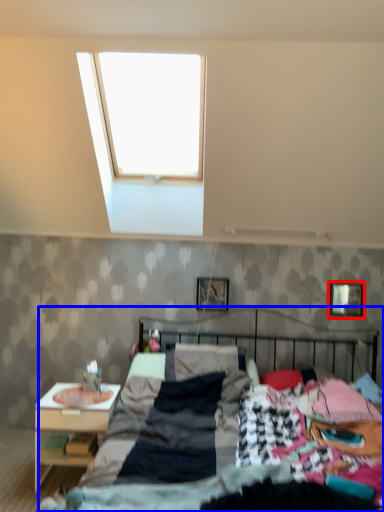
Question: Which of the following is the closest to the observer, picture frame (highlighted by a red box) or bed (highlighted by a blue box)?

Choices:
 (A) picture frame
 (B) bed

Answer: (B)